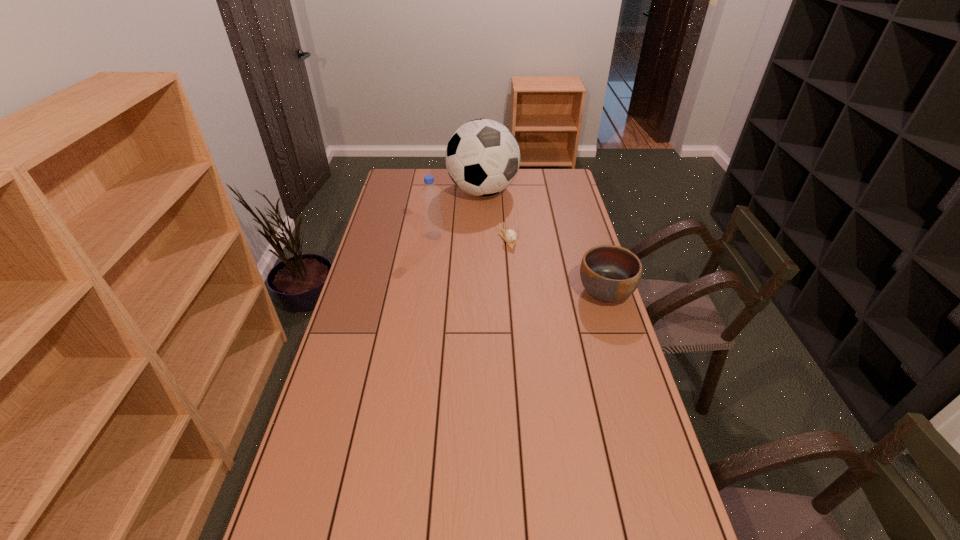
This screenshot has width=960, height=540. Find the location of `vacant space at the far left corner of the desktop`. vacant space at the far left corner of the desktop is located at coordinates click(390, 190).

Identify the location of vacant space at the near left corner. Image resolution: width=960 pixels, height=540 pixels. (346, 526).

Where is `vacant area between the nearest object and the third shortest object`? vacant area between the nearest object and the third shortest object is located at coordinates (519, 264).

This screenshot has height=540, width=960. Find the location of `free point between the soccer ball and the third tallest object`. free point between the soccer ball and the third tallest object is located at coordinates (544, 241).

I want to click on blank region between the soccer ball and the second tallest object, so click(x=458, y=213).

Where is `unoccupied area between the tallest object and the escargot`? unoccupied area between the tallest object and the escargot is located at coordinates (495, 215).

Identify the location of vacant area between the escargot and the rightmost object. (557, 266).

The width and height of the screenshot is (960, 540). Identify the location of vacant area that lies between the third shortest object and the rightmost object. (519, 264).

This screenshot has width=960, height=540. Identify the location of free spot between the shortest object and the farthest object. (495, 215).

Where is `free space between the bottle and the tallest object`? free space between the bottle and the tallest object is located at coordinates (458, 213).